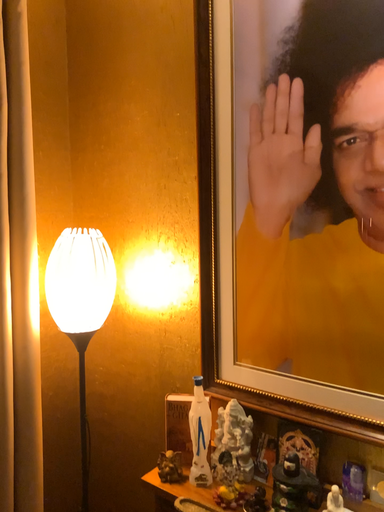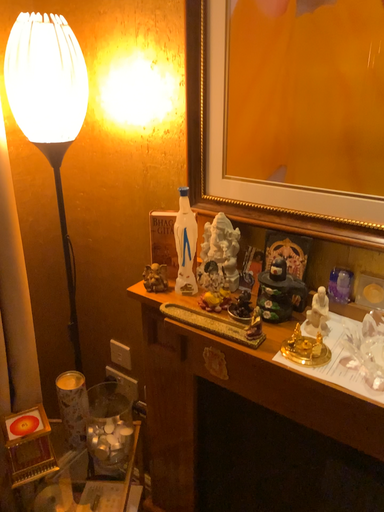
Question: Which way did the camera rotate in the video?

Choices:
 (A) rotated upward
 (B) rotated downward

Answer: (B)